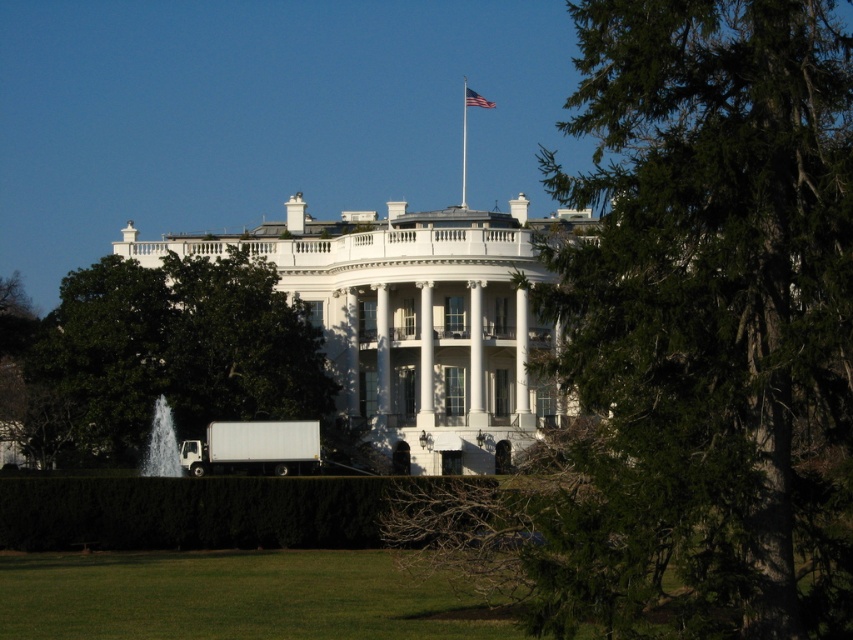
Question: Considering the relative positions of green leafy tree at upper right and green leafy tree at center in the image provided, where is green leafy tree at upper right located with respect to green leafy tree at center?

Choices:
 (A) right
 (B) left

Answer: (A)

Question: Among these objects, which one is nearest to the camera?

Choices:
 (A) american flag at upper center
 (B) white glossy water at lower left
 (C) white glossy column at center
 (D) green leafy hedge at lower center

Answer: (D)

Question: Among these objects, which one is nearest to the camera?

Choices:
 (A) white glossy water at lower left
 (B) green leafy hedge at lower center
 (C) green leafy tree at upper right

Answer: (C)

Question: Is green leafy hedge at lower center to the right of white glossy water at lower left from the viewer's perspective?

Choices:
 (A) yes
 (B) no

Answer: (A)

Question: Is green leafy tree at upper right below metallic flag pole at upper center?

Choices:
 (A) no
 (B) yes

Answer: (B)

Question: Among these points, which one is farthest from the camera?

Choices:
 (A) (126, 310)
 (B) (311, 477)

Answer: (A)